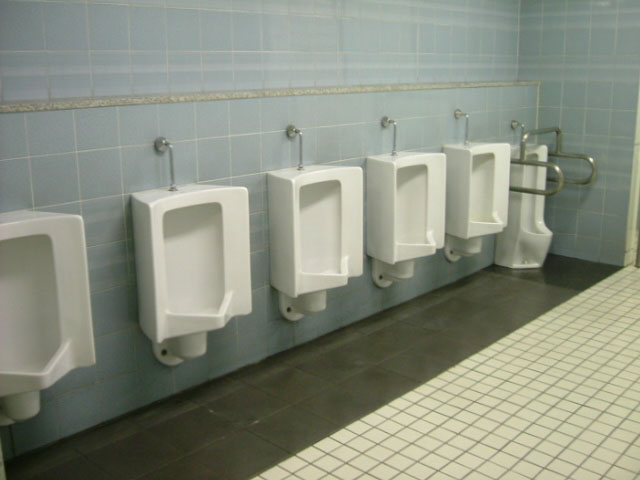
This screenshot has height=480, width=640. Find the location of `urinal water pipes`. urinal water pipes is located at coordinates (169, 144), (296, 133), (394, 125), (461, 112), (521, 123).